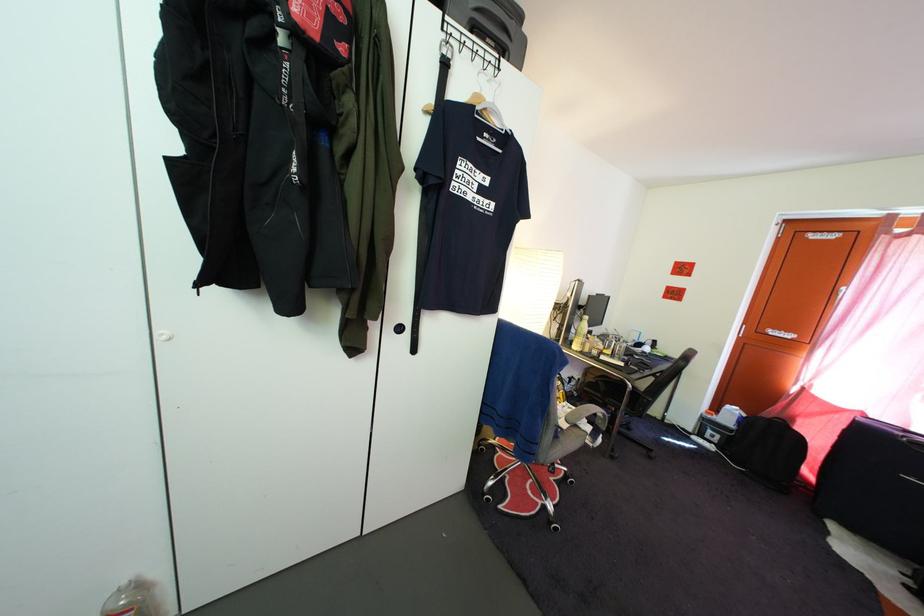
Find the location of a particular element. drinking glass is located at coordinates (619, 349).